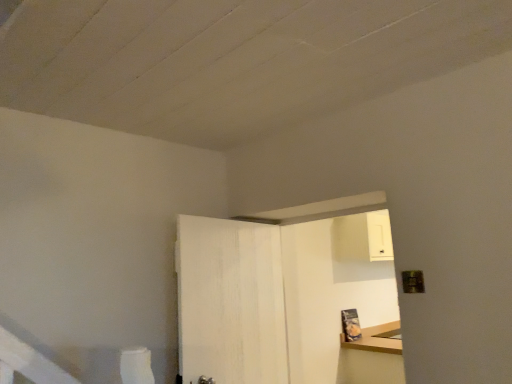
The image size is (512, 384). What do you see at coordinates (283, 301) in the screenshot?
I see `white wood dresser at upper right` at bounding box center [283, 301].

Find the location of a particular element. white wood dresser at upper right is located at coordinates (283, 301).

The width and height of the screenshot is (512, 384). What do you see at coordinates (230, 301) in the screenshot?
I see `white wood door at center` at bounding box center [230, 301].

In order to click on white wood door at center in this screenshot , I will do `click(230, 301)`.

The width and height of the screenshot is (512, 384). Identify the location of white wood dresser at upper right. (283, 301).

Is white wood door at center to the left or to the right of white wood dresser at upper right in the image?

In the image, white wood door at center appears on the left side of white wood dresser at upper right.

Does white wood door at center come behind white wood dresser at upper right?

No.

Does point (193, 302) lie in front of point (189, 338)?

No, it is not.

From the image's perspective, would you say white wood door at center is positioned over white wood dresser at upper right?

Yes, from the image's perspective, white wood door at center is over white wood dresser at upper right.

From a real-world perspective, which is physically below, white wood door at center or white wood dresser at upper right?

white wood dresser at upper right.

Does white wood door at center have a lesser width compared to white wood dresser at upper right?

Indeed, white wood door at center has a lesser width compared to white wood dresser at upper right.

Which of these two, white wood door at center or white wood dresser at upper right, stands shorter?

With less height is white wood door at center.

Can you confirm if white wood door at center is smaller than white wood dresser at upper right?

Indeed, white wood door at center has a smaller size compared to white wood dresser at upper right.

Is white wood door at center not within white wood dresser at upper right?

Yes, white wood door at center is located beyond the bounds of white wood dresser at upper right.

Is white wood door at center touching white wood dresser at upper right?

No, white wood door at center is not with white wood dresser at upper right.

Is white wood door at center facing towards white wood dresser at upper right?

Yes, white wood door at center is facing white wood dresser at upper right.

How different are the orientations of white wood door at center and white wood dresser at upper right in degrees?

The angle between the facing direction of white wood door at center and the facing direction of white wood dresser at upper right is 102 degrees.

At what (x,y) coordinates should I click in order to perform the action: click on door on the left side of white wood dresser at upper right. Please return your answer as a coordinate pair (x, y). This screenshot has height=384, width=512. Looking at the image, I should click on (230, 301).

Does white wood dresser at upper right appear on the right side of white wood door at center?

Yes, white wood dresser at upper right is to the right of white wood door at center.

Between white wood dresser at upper right and white wood door at center, which one is positioned behind?

white wood dresser at upper right is further away from the camera.

Does point (367, 260) lie behind point (192, 269)?

Yes, point (367, 260) is behind point (192, 269).

From the image's perspective, which one is positioned lower, white wood dresser at upper right or white wood door at center?

white wood dresser at upper right.

Consider the image. From a real-world perspective, is white wood dresser at upper right on white wood door at center?

Incorrect, from a real-world perspective, white wood dresser at upper right is lower than white wood door at center.

Can you confirm if white wood dresser at upper right is thinner than white wood door at center?

No, white wood dresser at upper right is not thinner than white wood door at center.

Is white wood dresser at upper right taller than white wood door at center?

Indeed, white wood dresser at upper right has a greater height compared to white wood door at center.

Considering the sizes of objects white wood dresser at upper right and white wood door at center in the image provided, who is bigger, white wood dresser at upper right or white wood door at center?

white wood dresser at upper right.

Is white wood dresser at upper right completely or partially outside of white wood door at center?

Yes.

Is white wood dresser at upper right not near white wood door at center?

They are positioned close to each other.

Is white wood dresser at upper right positioned with its back to white wood door at center?

No, white wood dresser at upper right is not facing the opposite direction of white wood door at center.

What's the angular difference between white wood dresser at upper right and white wood door at center's facing directions?

102 degrees.

How far apart are white wood dresser at upper right and white wood door at center?

white wood dresser at upper right and white wood door at center are 28.81 centimeters apart.

There is a white wood dresser at upper right. At what (x,y) coordinates should I click in order to perform the action: click on door above it (from a real-world perspective). Please return your answer as a coordinate pair (x, y). This screenshot has height=384, width=512. Looking at the image, I should click on (230, 301).

Find the location of a particular element. This screenshot has width=512, height=384. dresser on the right of white wood door at center is located at coordinates (283, 301).

Where is `door lying in front of the white wood dresser at upper right`? The height and width of the screenshot is (384, 512). door lying in front of the white wood dresser at upper right is located at coordinates (230, 301).